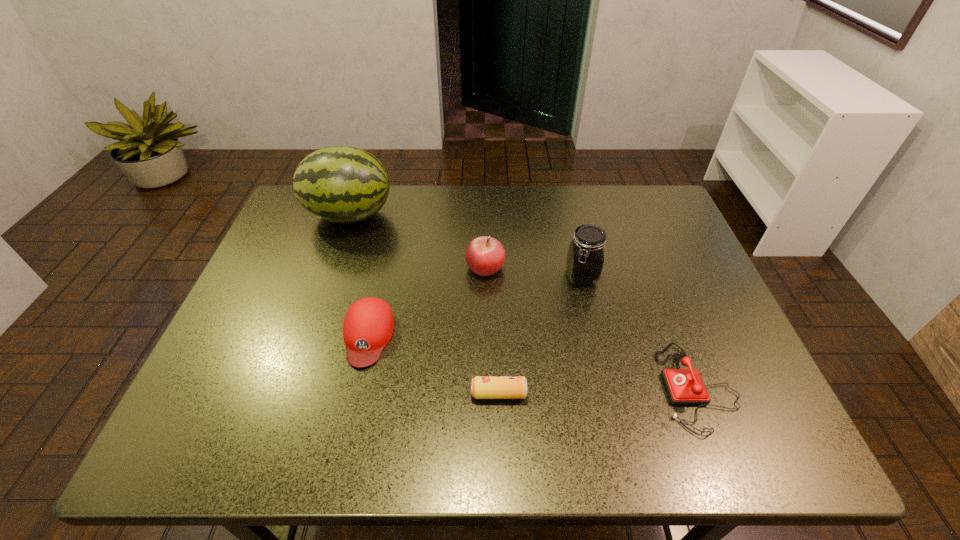
Identify the location of vacant space situated on the lid of the jar. The image size is (960, 540). (588, 305).

The image size is (960, 540). Find the location of `free point located 0.140m on the right of the third tallest object`. free point located 0.140m on the right of the third tallest object is located at coordinates (557, 267).

Where is `free space located 0.080m on the front-facing side of the baseball cap`? This screenshot has height=540, width=960. free space located 0.080m on the front-facing side of the baseball cap is located at coordinates (353, 403).

You are a GUI agent. You are given a task and a screenshot of the screen. Output one action in this format:
    pyautogui.click(x=<x>, y=<y>)
    Task: Click on the vacant space located 0.220m on the dial of the rightmost object
    This screenshot has width=960, height=540.
    Given the screenshot: What is the action you would take?
    pyautogui.click(x=556, y=388)

Image resolution: width=960 pixels, height=540 pixels. I want to click on vacant space situated on the dial of the rightmost object, so click(x=514, y=388).

Find the location of a particular element. vacant position located 0.290m on the dial of the rightmost object is located at coordinates (523, 388).

Identify the location of free region located on the right of the shortest object. Image resolution: width=960 pixels, height=540 pixels. (641, 393).

Identify the location of object located in the far edge section of the desktop. (341, 184).

Identify the location of object situated at the near edge. Image resolution: width=960 pixels, height=540 pixels. point(684,386).

Locate an element on the screen. object present at the left edge is located at coordinates (341, 184).